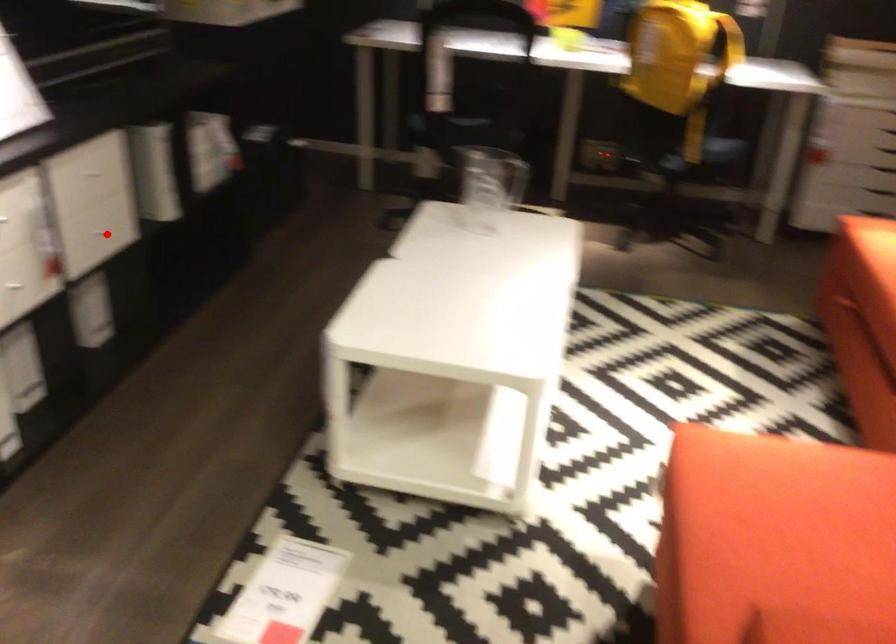
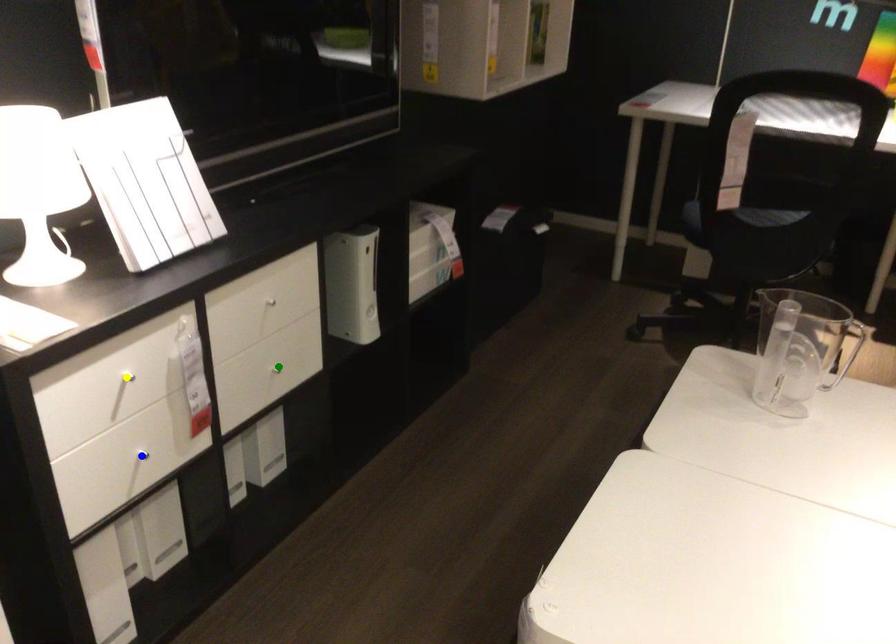
Question: I am providing you with two images of the same scene from different viewpoints. A red point is marked on the first image. You are given multiple points on the second image. Which point in image 2 is actually the same real-world point as the red point in image 1?

Choices:
 (A) blue point
 (B) yellow point
 (C) green point

Answer: (C)